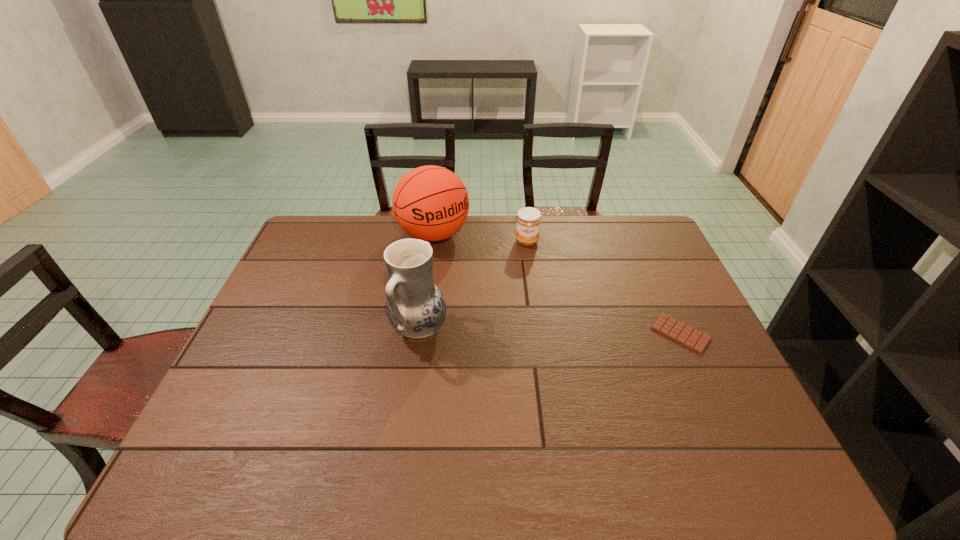
Find the location of a particular element. The image size is (960, 540). vacant space on the desktop that is between the pottery and the shortest object and is positioned on the front label of the second shortest object is located at coordinates (522, 330).

Identify the location of free space on the desktop that is between the pottery and the shortest object and is positioned on the side with logo of the basketball. This screenshot has height=540, width=960. (517, 330).